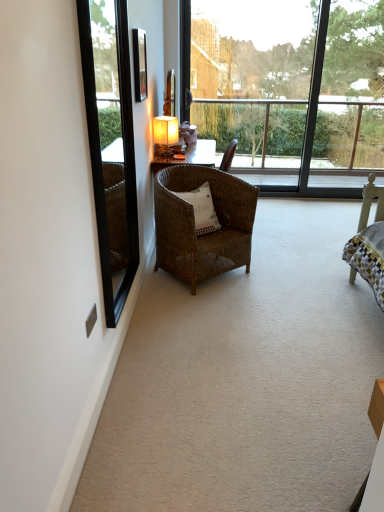
Where is `free space below black glass mirror at left (from a real-world perspective)`? This screenshot has height=512, width=384. free space below black glass mirror at left (from a real-world perspective) is located at coordinates (137, 326).